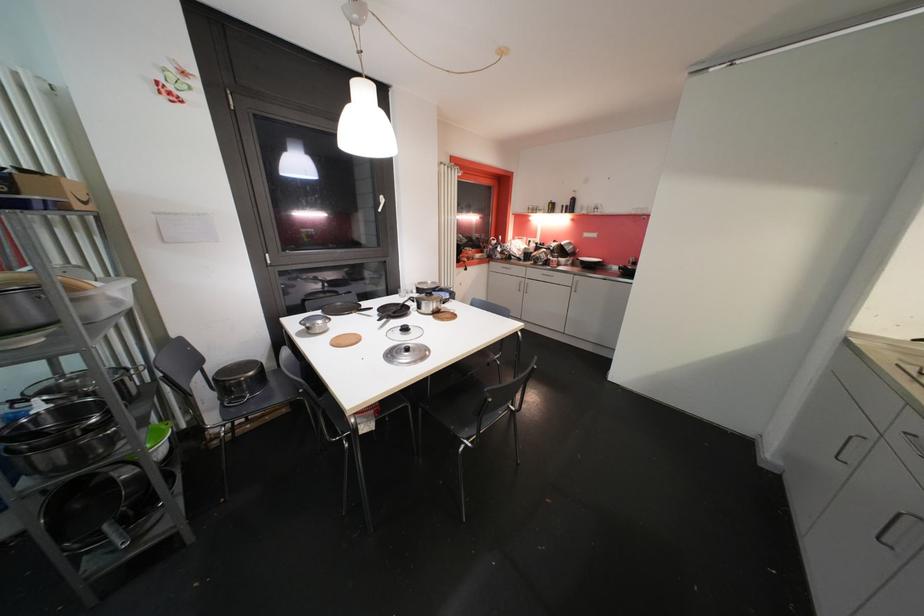
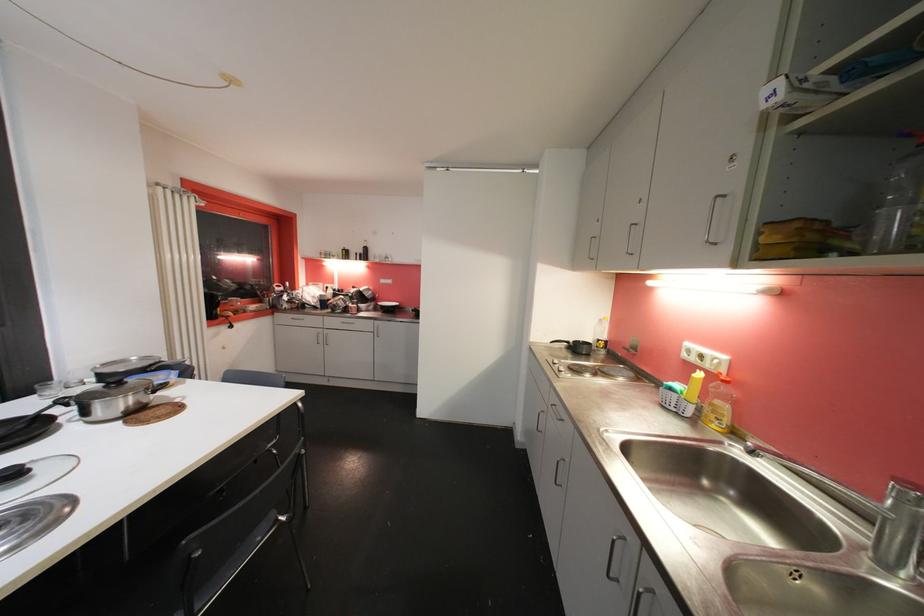
Question: How did the camera likely rotate?

Choices:
 (A) Left
 (B) Right
 (C) Up
 (D) Down

Answer: (B)